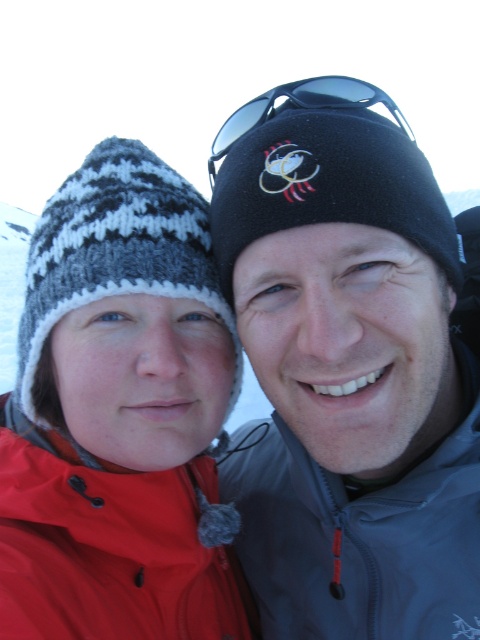
You are standing in a snowy area and see the gray synthetic jacket at right. If you want to reach it without moving your feet, is it within arm reach?

The gray synthetic jacket at right is 3.73 feet away from the viewer, which is beyond typical arm reach. You would need to move closer to grab it.

Consider the image. You are a photographer trying to capture a clear shot of the knitted woolen hat at left and the matte red jacket at lower left. Since the background is snowy and bright, you need to adjust your camera settings to avoid overexposure. Which object should you focus on first to ensure proper exposure?

The knitted woolen hat at left is positioned over matte red jacket at lower left, so focusing on the knitted woolen hat at left first would ensure it is properly exposed since it is closer to the camera.

Based on the photo, you are an outdoor photographer planning to capture the two individuals in the scene. You want to ensure the gray synthetic jacket at right is visible in the frame. Where should you position your camera relative to the point at coordinates (360, 534) to include the gray synthetic jacket at right in the shot?

Position the camera at the point at coordinates (360, 534) where the gray synthetic jacket at right is located to ensure it is visible in the frame.